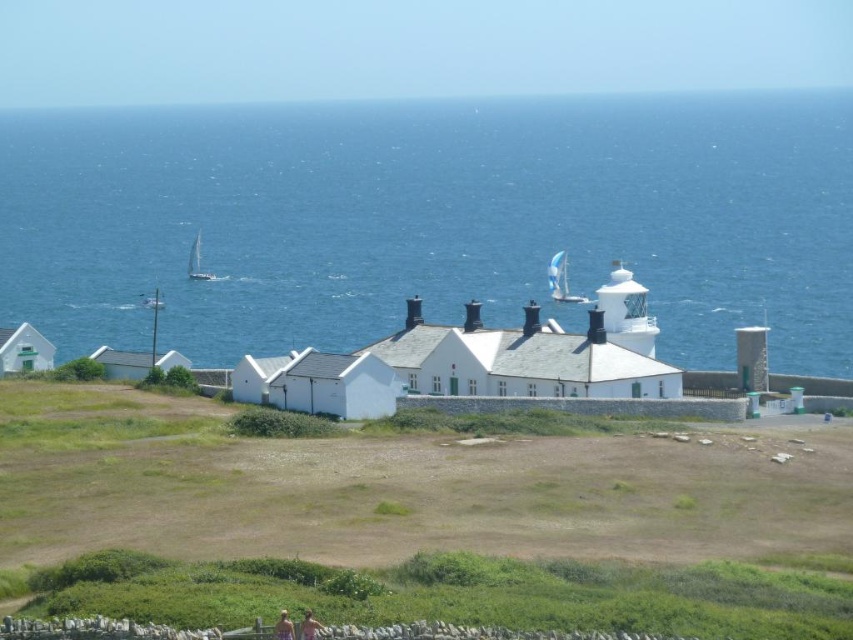
Is white sailboat at center positioned behind white plastic boat at left?

No.

The height and width of the screenshot is (640, 853). What do you see at coordinates (561, 280) in the screenshot?
I see `white sailboat at center` at bounding box center [561, 280].

Who is more distant from viewer, (556, 276) or (146, 300)?

The point (146, 300) is more distant.

Locate an element on the screen. This screenshot has height=640, width=853. white sailboat at center is located at coordinates (561, 280).

Which is in front, point (426, 273) or point (161, 301)?

Positioned in front is point (161, 301).

You are a GUI agent. You are given a task and a screenshot of the screen. Output one action in this format:
    pyautogui.click(x=<x>, y=<y>)
    Task: Click on the blue water at center
    
    Given the screenshot: What is the action you would take?
    pyautogui.click(x=432, y=220)

Find the location of a particular element. blue water at center is located at coordinates (432, 220).

Consider the image. Is white sailboat at left thinner than white plastic boat at left?

In fact, white sailboat at left might be wider than white plastic boat at left.

Is point (199, 234) positioned behind point (146, 305)?

Yes.

Is point (207, 273) behind point (160, 308)?

Yes, it is.

Where is `white sailboat at left`? Image resolution: width=853 pixels, height=640 pixels. white sailboat at left is located at coordinates (196, 262).